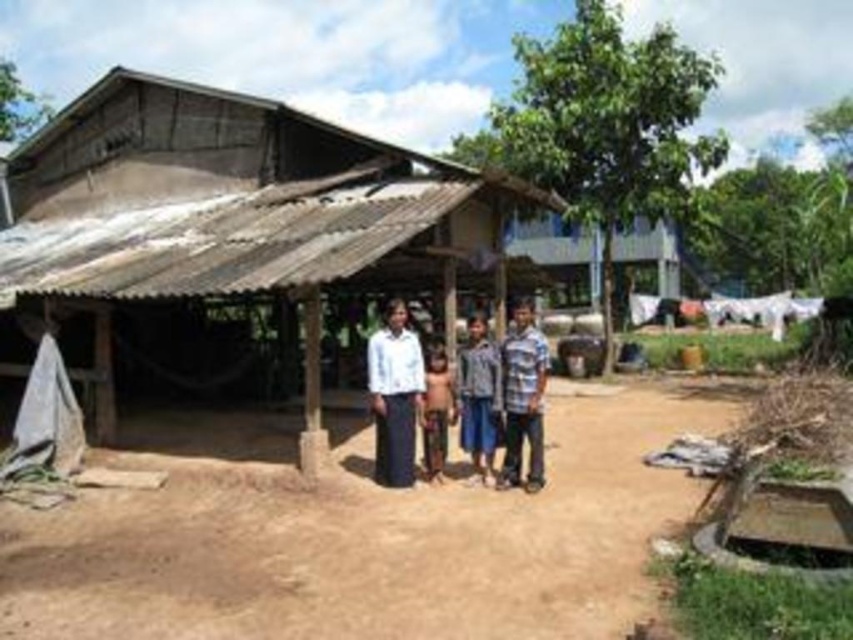
You are a farmer standing in the middle of the scene. You need to place a scarecrow made of the brown fabric at center on top of the brown sandy dirt field at center. Will the scarecrow be visible from the tree to the right of the shelter?

The brown sandy dirt field at center is not as tall as the brown fabric at center, so the scarecrow made of the brown fabric at center will be visible from the tree to the right of the shelter because it is taller than the field.

You are standing in front of the rustic shelter and want to place a small potted plant between the brown sandy dirt field at center and the white matte shirt at center. Which object should the plant be placed closer to in order to be closer to the viewer?

The brown sandy dirt field at center is closer to the viewer than the white matte shirt at center, so the plant should be placed closer to the brown sandy dirt field at center to be nearer to the viewer.

You are planning to set up a small tent in the brown sandy dirt field at center. You have a tarp made of brown fabric at center that you want to use as a cover. Will the tarp be large enough to cover the entire field?

The brown sandy dirt field at center is wider than the brown fabric at center, so the tarp made of brown fabric at center will not be large enough to cover the entire field.